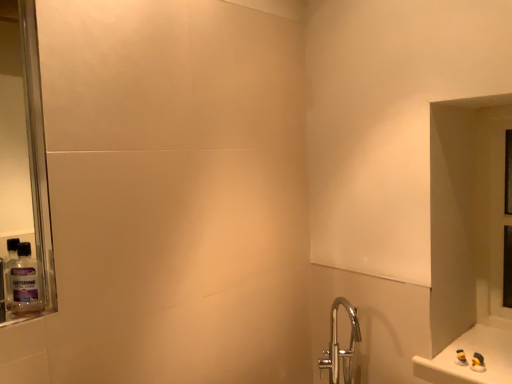
Question: From the image's perspective, is transparent glass door at right above or below clear plastic mouthwash at left?

Choices:
 (A) above
 (B) below

Answer: (A)

Question: Looking at their shapes, would you say transparent glass door at right is wider or thinner than clear plastic mouthwash at left?

Choices:
 (A) wide
 (B) thin

Answer: (A)

Question: Estimate the real-world distances between objects in this image. Which object is closer to the transparent glass door at right?

Choices:
 (A) clear plastic mouthwash at left
 (B) white glossy counter at lower right

Answer: (B)

Question: Which is farther from the white glossy counter at lower right?

Choices:
 (A) clear plastic mouthwash at left
 (B) transparent glass door at right

Answer: (A)